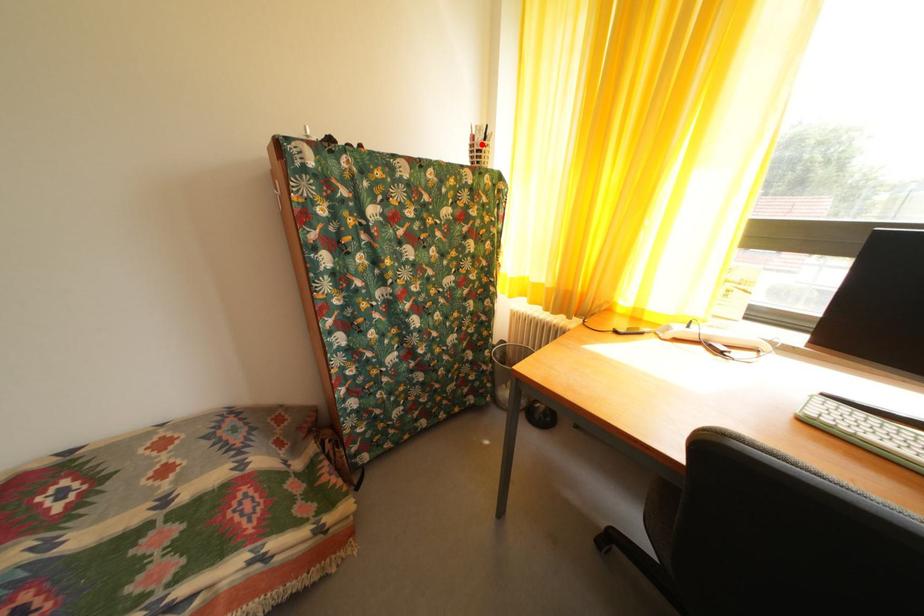
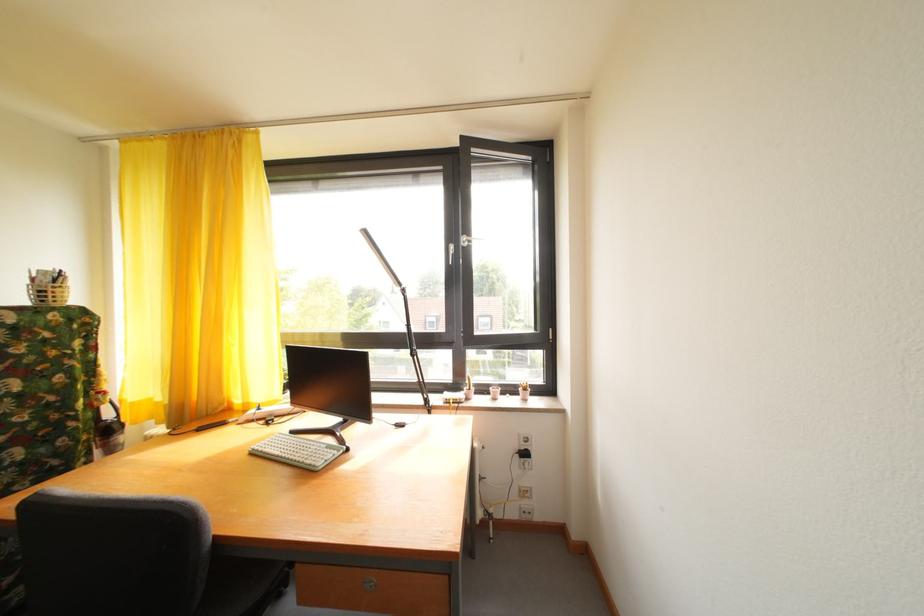
Where in the second image is the point corresponding to the highlighted location from the first image?

(43, 286)